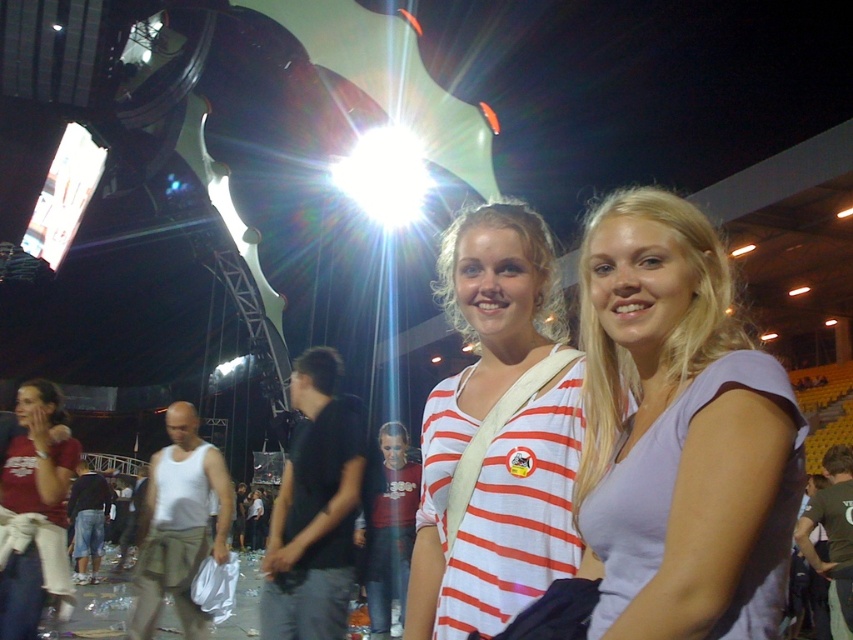
Who is positioned more to the right, purple matte shirt at center or matte red shirt at lower left?

From the viewer's perspective, purple matte shirt at center appears more on the right side.

Does purple matte shirt at center have a lesser height compared to matte red shirt at lower left?

In fact, purple matte shirt at center may be taller than matte red shirt at lower left.

This screenshot has height=640, width=853. I want to click on purple matte shirt at center, so click(679, 433).

Does point (312, 449) come closer to viewer compared to point (219, 524)?

Yes, point (312, 449) is in front of point (219, 524).

Does black cotton shirt at center have a lesser height compared to white cotton tank top at center?

Incorrect, black cotton shirt at center's height does not fall short of white cotton tank top at center's.

Is point (320, 625) positioned after point (218, 474)?

No.

Image resolution: width=853 pixels, height=640 pixels. I want to click on black cotton shirt at center, so click(314, 509).

Who is more forward, (599, 364) or (311, 412)?

Point (599, 364) is more forward.

Measure the distance from purple matte shirt at center to black cotton shirt at center.

purple matte shirt at center is 11.94 meters away from black cotton shirt at center.

Who is more distant from viewer, (675,268) or (305,570)?

The point (305,570) is more distant.

Find the location of `purple matte shirt at center`. purple matte shirt at center is located at coordinates (679, 433).